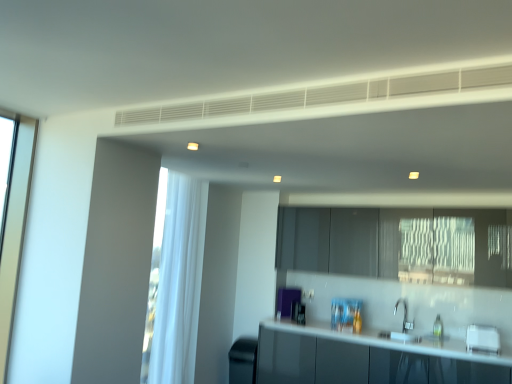
The width and height of the screenshot is (512, 384). Describe the element at coordinates (395, 244) in the screenshot. I see `matte gray cabinetry at center` at that location.

In order to face black matte trash can at lower left, the 2th appliance positioned from the right, should I rotate leftwards or rightwards?

To align with it, rotate left about 1.112°.

Find the location of a particular element. Image resolution: width=512 pixels, height=384 pixels. white matte exhaust hood at upper center is located at coordinates (324, 95).

I want to click on matte gray cabinetry at center, so click(395, 244).

Measure the distance from glossy white countertop at lower center to white matte exhaust hood at upper center.

They are 9.04 feet apart.

Looking at this image, could you tell me if glossy white countertop at lower center is facing white matte exhaust hood at upper center?

No, glossy white countertop at lower center does not turn towards white matte exhaust hood at upper center.

Identify the location of exhaust hood above the glossy white countertop at lower center (from the image's perspective). The image size is (512, 384). (324, 95).

From the image's perspective, is glossy white countertop at lower center below white matte exhaust hood at upper center?

Yes, from the image's perspective, glossy white countertop at lower center is beneath white matte exhaust hood at upper center.

From a real-world perspective, starting from the white matte exhaust hood at upper center, which appliance is the 1st one below it? Please provide its 2D coordinates.

[(482, 339)]

Considering the relative positions of white glossy toaster at lower right, which is the second appliance from bottom to top, and white matte exhaust hood at upper center in the image provided, is white glossy toaster at lower right, which is the second appliance from bottom to top, behind white matte exhaust hood at upper center?

Yes, it is.

Which is less distant, (498,344) or (385,87)?

Point (498,344) is positioned farther from the camera compared to point (385,87).

Considering the sizes of white glossy toaster at lower right, acting as the 1th appliance starting from the right, and white matte exhaust hood at upper center in the image, is white glossy toaster at lower right, acting as the 1th appliance starting from the right, bigger or smaller than white matte exhaust hood at upper center?

In the image, white glossy toaster at lower right, acting as the 1th appliance starting from the right, appears to be smaller than white matte exhaust hood at upper center.

Are white sheer curtain at left and glossy white countertop at lower center making contact?

They are not placed beside each other.

Image resolution: width=512 pixels, height=384 pixels. Identify the location of countertop below the white sheer curtain at left (from the image's perspective). (392, 342).

Is white sheer curtain at left smaller than glossy white countertop at lower center?

Correct, white sheer curtain at left occupies less space than glossy white countertop at lower center.

Is matte gray cabinetry at center taller than black matte trash can at lower left, which is counted as the first appliance, starting from the bottom?

Indeed, matte gray cabinetry at center has a greater height compared to black matte trash can at lower left, which is counted as the first appliance, starting from the bottom.

Does matte gray cabinetry at center have a smaller size compared to black matte trash can at lower left, which ranks as the first appliance in back-to-front order?

Incorrect, matte gray cabinetry at center is not smaller in size than black matte trash can at lower left, which ranks as the first appliance in back-to-front order.

Based on the photo, is black matte trash can at lower left, which is counted as the first appliance, starting from the bottom, at the back of matte gray cabinetry at center?

No, matte gray cabinetry at center's orientation is not away from black matte trash can at lower left, which is counted as the first appliance, starting from the bottom.

Is point (403, 250) closer to viewer compared to point (239, 349)?

Yes, it is.

Measure the distance from white sheer curtain at left to white matte exhaust hood at upper center.

white sheer curtain at left is 7.45 feet from white matte exhaust hood at upper center.

From a real-world perspective, is white sheer curtain at left above or below white matte exhaust hood at upper center?

From a real-world perspective, white sheer curtain at left is physically below white matte exhaust hood at upper center.

Is point (152, 275) closer to viewer compared to point (462, 72)?

No, it is behind (462, 72).

In the scene shown: Is white sheer curtain at left oriented towards white matte exhaust hood at upper center?

No, white sheer curtain at left is not oriented towards white matte exhaust hood at upper center.

Considering the relative sizes of white glossy toaster at lower right, the 1th appliance from the top, and glossy white countertop at lower center in the image provided, is white glossy toaster at lower right, the 1th appliance from the top, taller than glossy white countertop at lower center?

No, white glossy toaster at lower right, the 1th appliance from the top, is not taller than glossy white countertop at lower center.

Is white glossy toaster at lower right, the first appliance in the front-to-back sequence, positioned beyond the bounds of glossy white countertop at lower center?

Yes.

Can you confirm if white glossy toaster at lower right, which ranks as the 2th appliance in left-to-right order, is wider than glossy white countertop at lower center?

Incorrect, the width of white glossy toaster at lower right, which ranks as the 2th appliance in left-to-right order, does not surpass that of glossy white countertop at lower center.

How different are the orientations of white matte exhaust hood at upper center and white sheer curtain at left in degrees?

white matte exhaust hood at upper center and white sheer curtain at left are facing 90.8 degrees away from each other.

Can you confirm if white matte exhaust hood at upper center is thinner than white sheer curtain at left?

Yes, white matte exhaust hood at upper center is thinner than white sheer curtain at left.

Between white matte exhaust hood at upper center and white sheer curtain at left, which one has larger size?

With larger size is white sheer curtain at left.

Image resolution: width=512 pixels, height=384 pixels. What are the coordinates of `exhaust hood above the white sheer curtain at left (from a real-world perspective)` in the screenshot? It's located at tap(324, 95).

The image size is (512, 384). In order to click on exhaust hood on the left of glossy white countertop at lower center in this screenshot , I will do `click(324, 95)`.

Locate an element on the screen. The image size is (512, 384). exhaust hood that is in front of the white glossy toaster at lower right, which ranks as the 2th appliance in left-to-right order is located at coordinates (324, 95).

When comparing their distances from white sheer curtain at left, does black matte trash can at lower left, placed as the 1th appliance when sorted from left to right, or glossy white countertop at lower center seem closer?

Based on the image, black matte trash can at lower left, placed as the 1th appliance when sorted from left to right, appears to be nearer to white sheer curtain at left.

Which object lies further to the anchor point white matte exhaust hood at upper center, white sheer curtain at left or black matte trash can at lower left, which ranks as the first appliance in back-to-front order?

black matte trash can at lower left, which ranks as the first appliance in back-to-front order.

Based on their spatial positions, is white glossy toaster at lower right, the first appliance in the front-to-back sequence, or black matte trash can at lower left, placed as the 1th appliance when sorted from left to right, further from matte gray cabinetry at center?

black matte trash can at lower left, placed as the 1th appliance when sorted from left to right, is further to matte gray cabinetry at center.

Which object lies nearer to the anchor point black matte trash can at lower left, placed as the 2th appliance when sorted from top to bottom, glossy white countertop at lower center or white glossy toaster at lower right, acting as the 1th appliance starting from the right?

glossy white countertop at lower center is closer to black matte trash can at lower left, placed as the 2th appliance when sorted from top to bottom.

Estimate the real-world distances between objects in this image. Which object is closer to matte gray cabinetry at center, black matte trash can at lower left, which is the second appliance from front to back, or glossy white countertop at lower center?

The object closer to matte gray cabinetry at center is glossy white countertop at lower center.

Estimate the real-world distances between objects in this image. Which object is further from matte gray cabinetry at center, white matte exhaust hood at upper center or white sheer curtain at left?

white matte exhaust hood at upper center is further to matte gray cabinetry at center.

When comparing their distances from white sheer curtain at left, does white matte exhaust hood at upper center or black matte trash can at lower left, placed as the 1th appliance when sorted from left to right, seem further?

Based on the image, white matte exhaust hood at upper center appears to be further to white sheer curtain at left.

Estimate the real-world distances between objects in this image. Which object is closer to white matte exhaust hood at upper center, glossy white countertop at lower center or black matte trash can at lower left, placed as the 1th appliance when sorted from left to right?

glossy white countertop at lower center lies closer to white matte exhaust hood at upper center than the other object.

Image resolution: width=512 pixels, height=384 pixels. In order to click on appliance located between white sheer curtain at left and glossy white countertop at lower center in the left-right direction in this screenshot , I will do pyautogui.click(x=243, y=361).

You are a GUI agent. You are given a task and a screenshot of the screen. Output one action in this format:
    pyautogui.click(x=<x>, y=<y>)
    Task: Click on the appliance between matte gray cabinetry at center and glossy white countertop at lower center in the vertical direction
    Image resolution: width=512 pixels, height=384 pixels.
    Given the screenshot: What is the action you would take?
    pyautogui.click(x=482, y=339)

In order to click on appliance between white matte exhaust hood at upper center and glossy white countertop at lower center in the vertical direction in this screenshot , I will do `click(482, 339)`.

I want to click on cabinetry between white sheer curtain at left and white glossy toaster at lower right, the 1th appliance from the top, in the horizontal direction, so click(x=395, y=244).